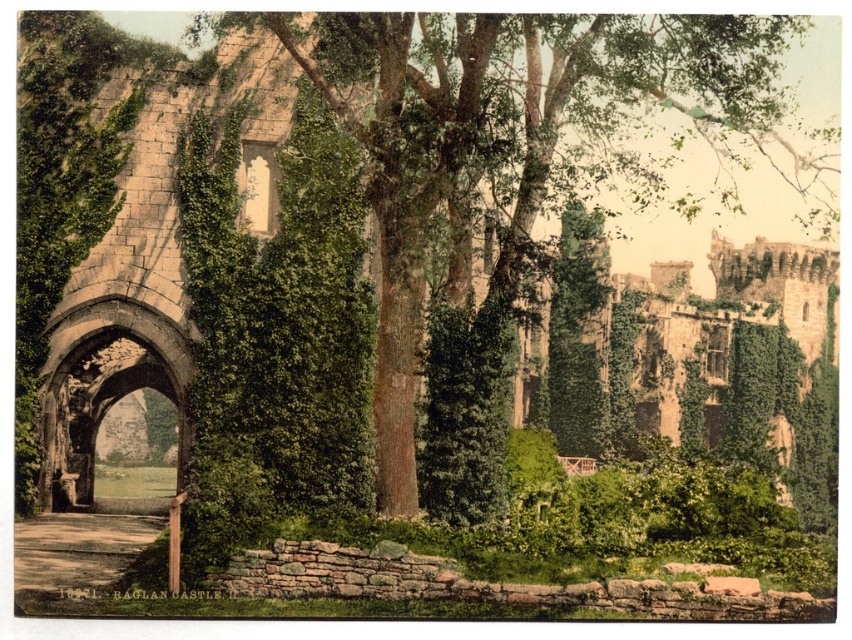
Question: Observing the image, what is the correct spatial positioning of green leafy tree at center in reference to stone archway at center?

Choices:
 (A) left
 (B) right

Answer: (B)

Question: Where is green leafy tree at center located in relation to smooth concrete path at lower left in the image?

Choices:
 (A) below
 (B) above

Answer: (B)

Question: Which of the following is the farthest from the observer?

Choices:
 (A) stone archway at center
 (B) green leafy tree at center

Answer: (A)

Question: Which point appears closest to the camera in this image?

Choices:
 (A) (144, 531)
 (B) (743, 100)

Answer: (A)

Question: Which object is closer to the camera taking this photo?

Choices:
 (A) smooth concrete path at lower left
 (B) green leafy tree at center

Answer: (A)

Question: Is green leafy tree at center to the right of stone archway at center from the viewer's perspective?

Choices:
 (A) no
 (B) yes

Answer: (B)